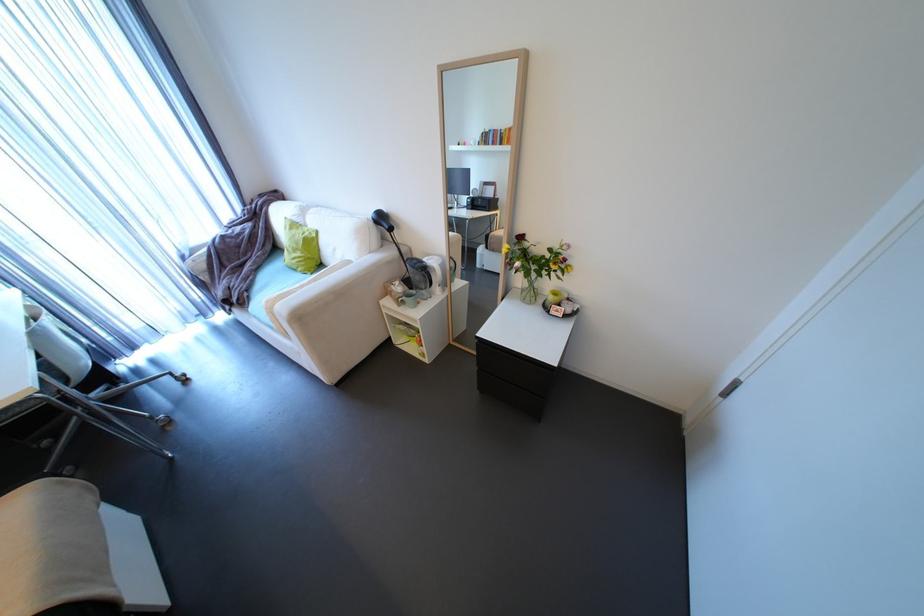
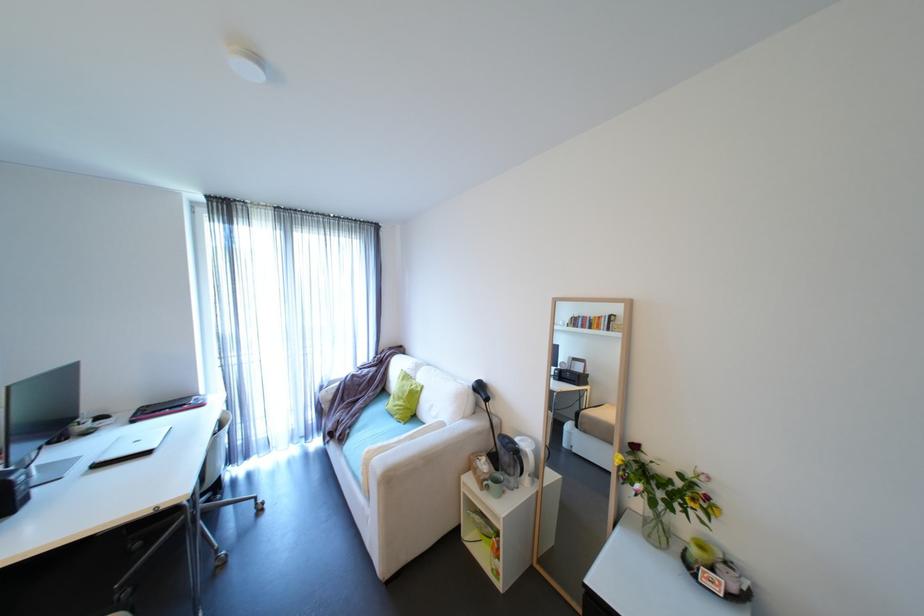
Locate, in the second image, the point that corresponds to the point at 195,254 in the first image.

(333, 386)